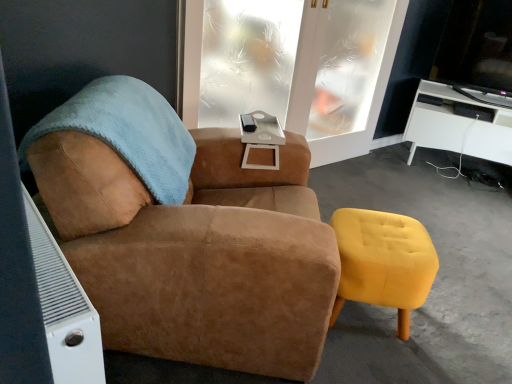
Find the location of a particular element. This screenshot has height=384, width=512. free region under white glossy desk at right (from a real-world perspective) is located at coordinates (439, 165).